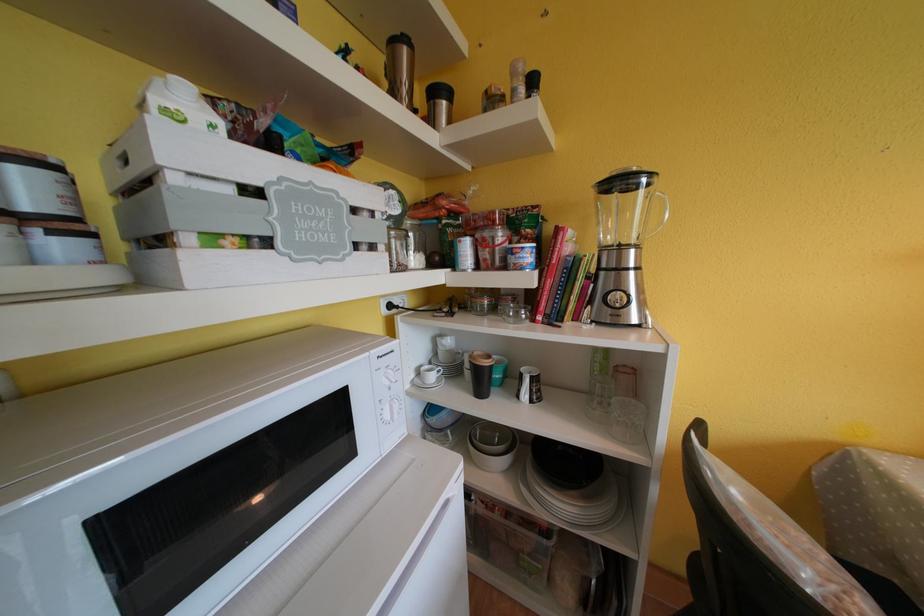
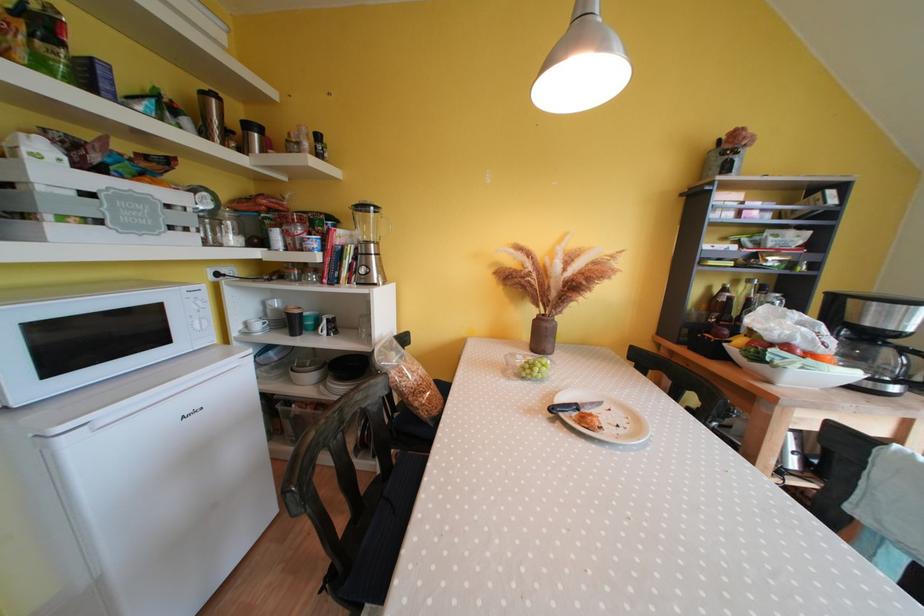
Locate, in the second image, the point that corresponds to [638,254] in the first image.

(379, 249)